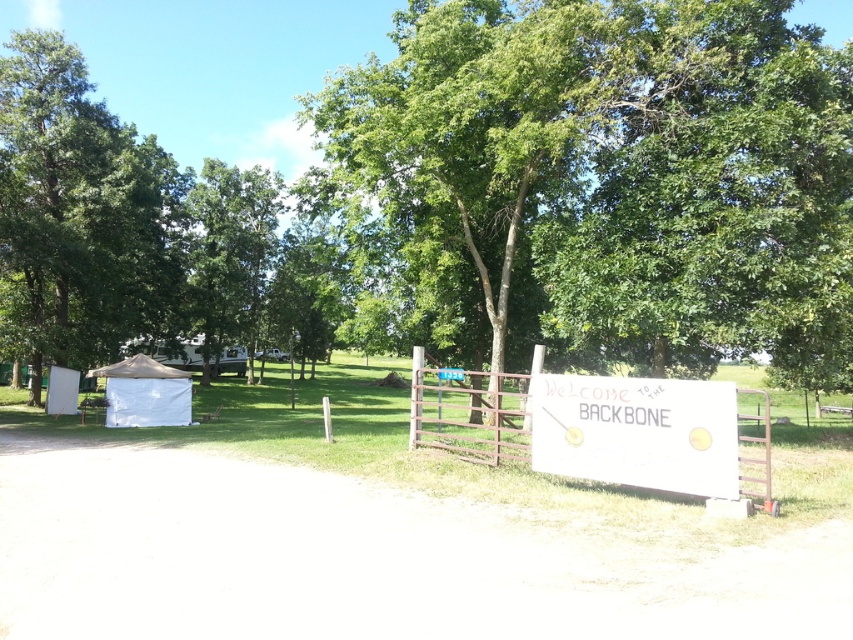
Does green leafy tree at center appear on the right side of white painted wood sign at center?

Yes, green leafy tree at center is to the right of white painted wood sign at center.

Is point (440, 256) farther from camera compared to point (653, 452)?

Yes, it is.

Identify the location of green leafy tree at center. (613, 173).

Image resolution: width=853 pixels, height=640 pixels. What are the coordinates of `green leafy tree at center` in the screenshot? It's located at (613, 173).

Is green leafy tree at center positioned in front of metallic silver gate at center?

No, it is not.

Which is behind, point (628, 333) or point (483, 416)?

Point (483, 416)

You are a GUI agent. You are given a task and a screenshot of the screen. Output one action in this format:
    pyautogui.click(x=<x>, y=<y>)
    Task: Click on the green leafy tree at center
    
    Given the screenshot: What is the action you would take?
    pyautogui.click(x=613, y=173)

Who is taller, white painted metal fence at center or white canvas tent at left?

Standing taller between the two is white painted metal fence at center.

Can you confirm if white painted metal fence at center is shorter than white canvas tent at left?

Incorrect, white painted metal fence at center's height does not fall short of white canvas tent at left's.

Measure the distance between point (445, 387) and camera.

Point (445, 387) and camera are 14.00 meters apart.

At what (x,y) coordinates should I click in order to perform the action: click on white painted metal fence at center. Please return your answer as a coordinate pair (x, y). The width and height of the screenshot is (853, 640). Looking at the image, I should click on (477, 413).